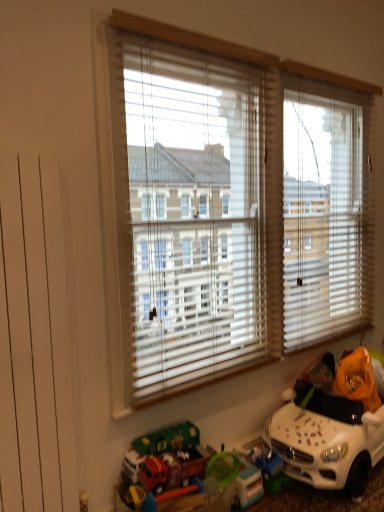
Question: Considering the positions of white plastic toy car at lower right, the 1th toy in the right-to-left sequence, and white blinds at center in the image, is white plastic toy car at lower right, the 1th toy in the right-to-left sequence, bigger or smaller than white blinds at center?

Choices:
 (A) small
 (B) big

Answer: (A)

Question: Is white plastic toy car at lower right, the 1th toy in the right-to-left sequence, taller or shorter than white blinds at center?

Choices:
 (A) short
 (B) tall

Answer: (A)

Question: Which is nearer to the red plastic fire truck at lower center, the 2th toy when ordered from right to left?

Choices:
 (A) white plastic toy car at lower right, acting as the 2th toy starting from the left
 (B) white blinds at center

Answer: (A)

Question: Which is farther from the red plastic fire truck at lower center, the first toy positioned from the left?

Choices:
 (A) white plastic toy car at lower right, the 1th toy in the right-to-left sequence
 (B) white blinds at center

Answer: (B)